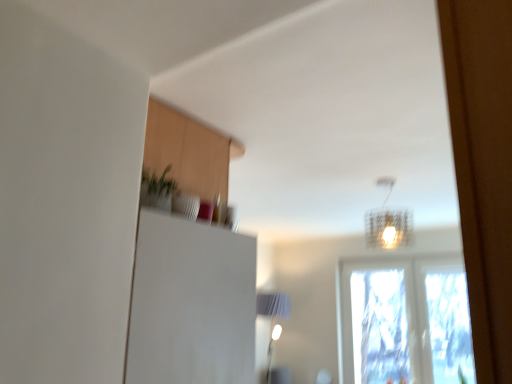
Question: Is transparent glass window at center surrounding translucent wire mesh lampshade at upper center?

Choices:
 (A) yes
 (B) no

Answer: (B)

Question: Can you confirm if transparent glass window at center is bigger than translucent wire mesh lampshade at upper center?

Choices:
 (A) no
 (B) yes

Answer: (B)

Question: From the image's perspective, is transparent glass window at center below translucent wire mesh lampshade at upper center?

Choices:
 (A) no
 (B) yes

Answer: (B)

Question: From the image's perspective, is transparent glass window at center on translucent wire mesh lampshade at upper center?

Choices:
 (A) no
 (B) yes

Answer: (A)

Question: Is transparent glass window at center wider than translucent wire mesh lampshade at upper center?

Choices:
 (A) yes
 (B) no

Answer: (B)

Question: Is there a large distance between transparent glass window at center and translucent wire mesh lampshade at upper center?

Choices:
 (A) yes
 (B) no

Answer: (B)

Question: Would you consider translucent wire mesh lampshade at upper center to be distant from transparent glass window at center?

Choices:
 (A) yes
 (B) no

Answer: (B)

Question: Considering the relative sizes of translucent wire mesh lampshade at upper center and transparent glass window at center in the image provided, is translucent wire mesh lampshade at upper center smaller than transparent glass window at center?

Choices:
 (A) no
 (B) yes

Answer: (B)

Question: Is translucent wire mesh lampshade at upper center taller than transparent glass window at center?

Choices:
 (A) no
 (B) yes

Answer: (A)

Question: Is transparent glass window at center surrounded by translucent wire mesh lampshade at upper center?

Choices:
 (A) no
 (B) yes

Answer: (A)

Question: From a real-world perspective, is translucent wire mesh lampshade at upper center located beneath transparent glass window at center?

Choices:
 (A) yes
 (B) no

Answer: (B)

Question: Is translucent wire mesh lampshade at upper center placed right next to transparent glass window at center?

Choices:
 (A) yes
 (B) no

Answer: (B)

Question: From the image's perspective, is translucent wire mesh lampshade at upper center positioned above or below transparent glass window at center?

Choices:
 (A) above
 (B) below

Answer: (A)